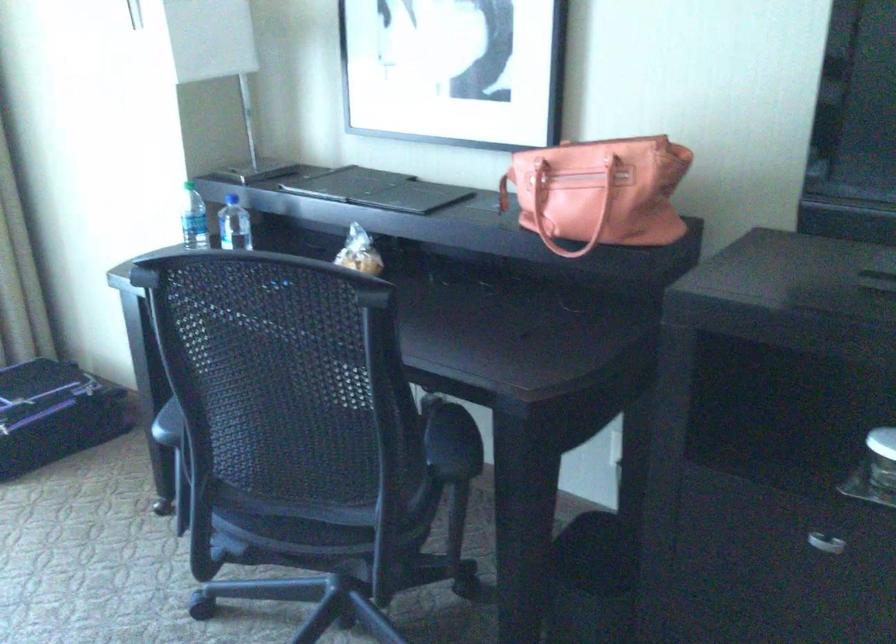
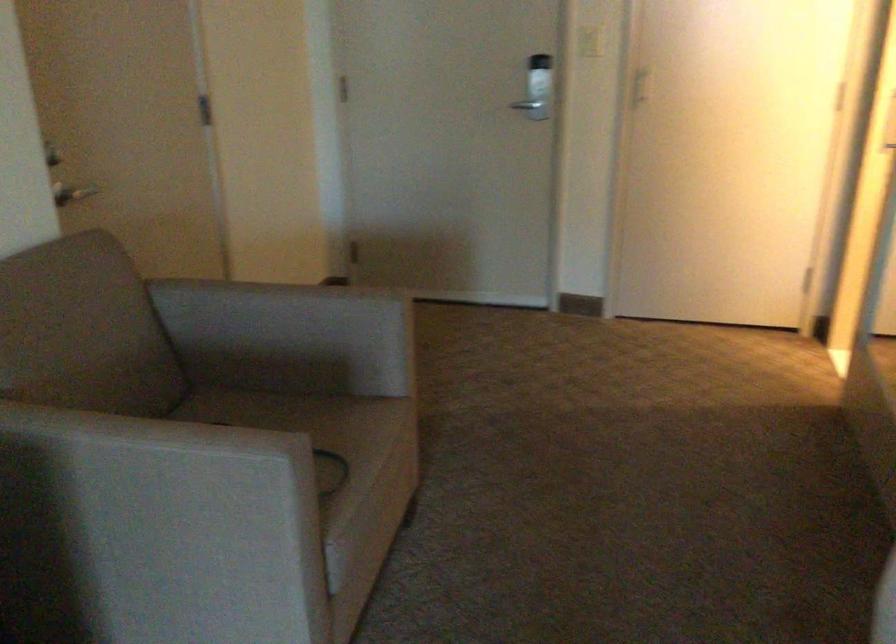
The images are taken continuously from a first-person perspective. In which direction is your viewpoint rotating?

The camera rotated toward right-down.